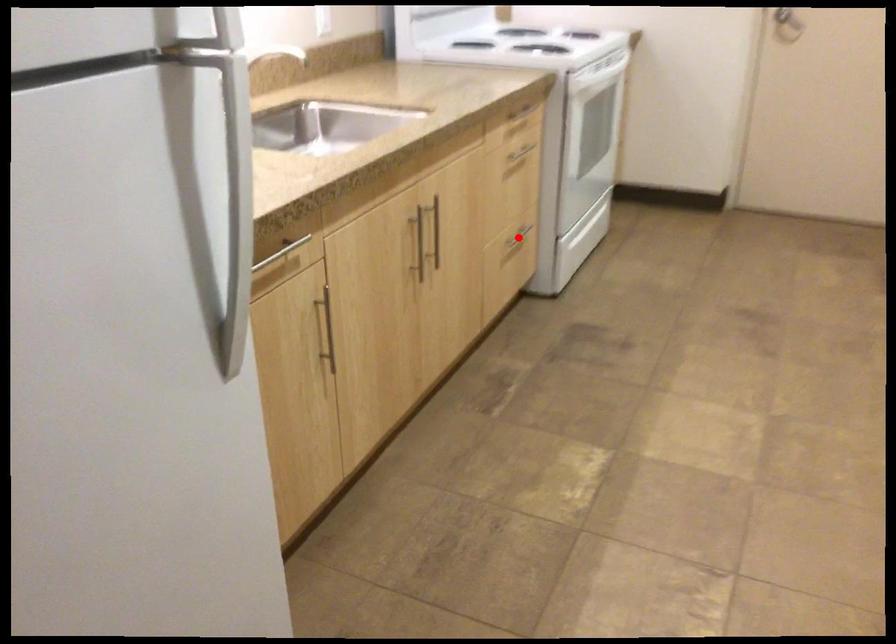
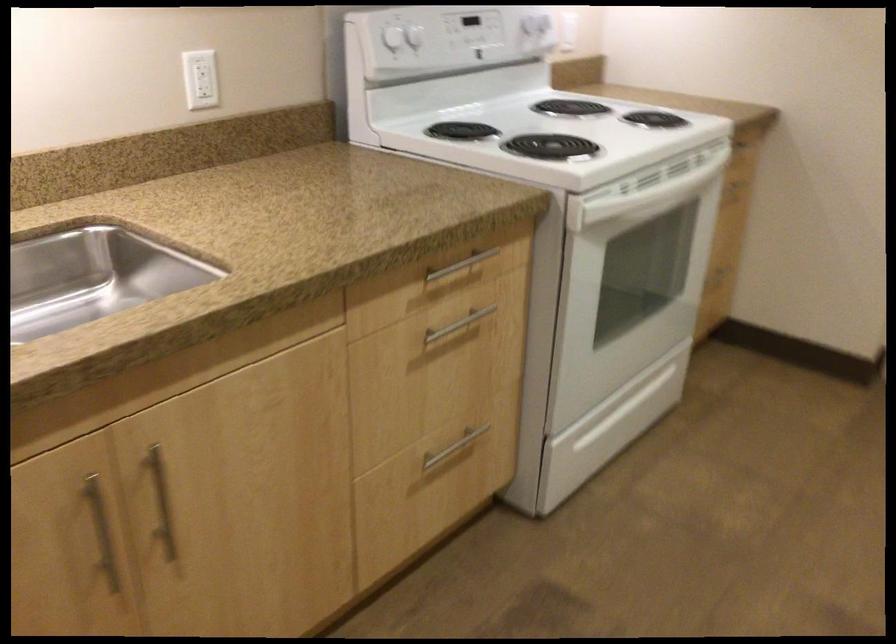
Find the pixel in the second image that matches the highlighted location in the first image.

(453, 448)